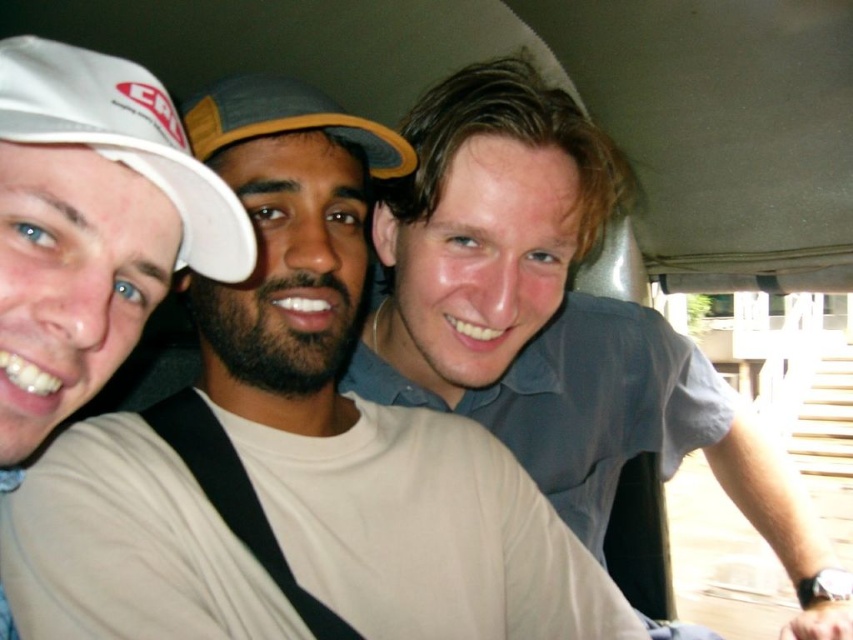
Which is in front, point (222, 196) or point (184, 120)?

Point (222, 196) is more forward.

Identify the location of white fabric cap at left. This screenshot has height=640, width=853. (125, 140).

Is point (119, 125) farther from viewer compared to point (201, 145)?

No, (119, 125) is closer to viewer.

The height and width of the screenshot is (640, 853). Identify the location of white fabric cap at left. (125, 140).

Can you confirm if white matte cap at left is taller than gray fabric baseball cap at center?

Correct, white matte cap at left is much taller as gray fabric baseball cap at center.

Between white matte cap at left and gray fabric baseball cap at center, which one appears on the left side from the viewer's perspective?

Positioned to the left is white matte cap at left.

Which is behind, point (181, 134) or point (186, 104)?

The point (186, 104) is behind.

I want to click on white matte cap at left, so click(91, 227).

Is point (50, 332) positioned after point (61, 115)?

Yes, it is behind point (61, 115).

Which is above, white matte cap at left or white fabric cap at left?

white fabric cap at left is higher up.

Looking at this image, who is more distant from viewer, [103,108] or [167,115]?

The point [167,115] is behind.

Locate an element on the screen. white matte cap at left is located at coordinates tap(91, 227).